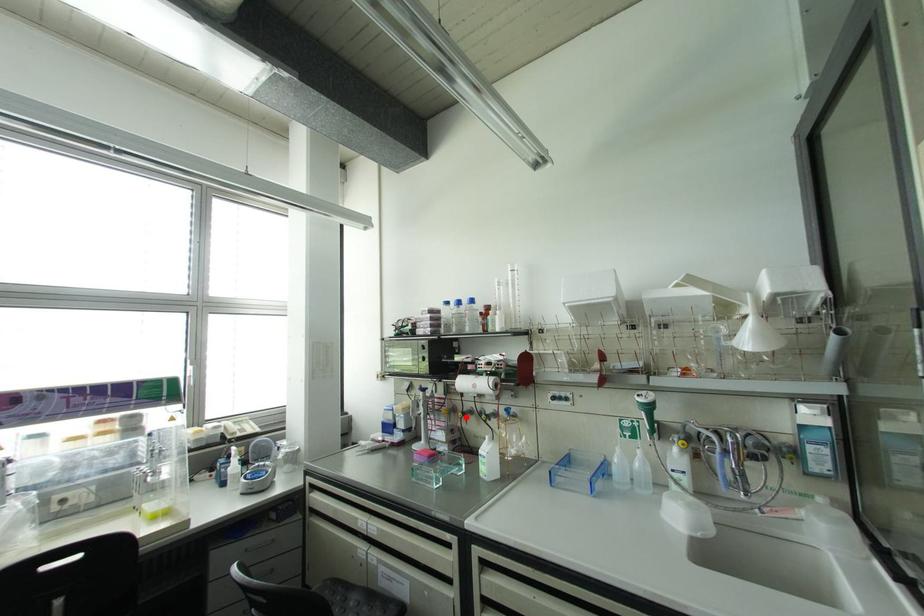
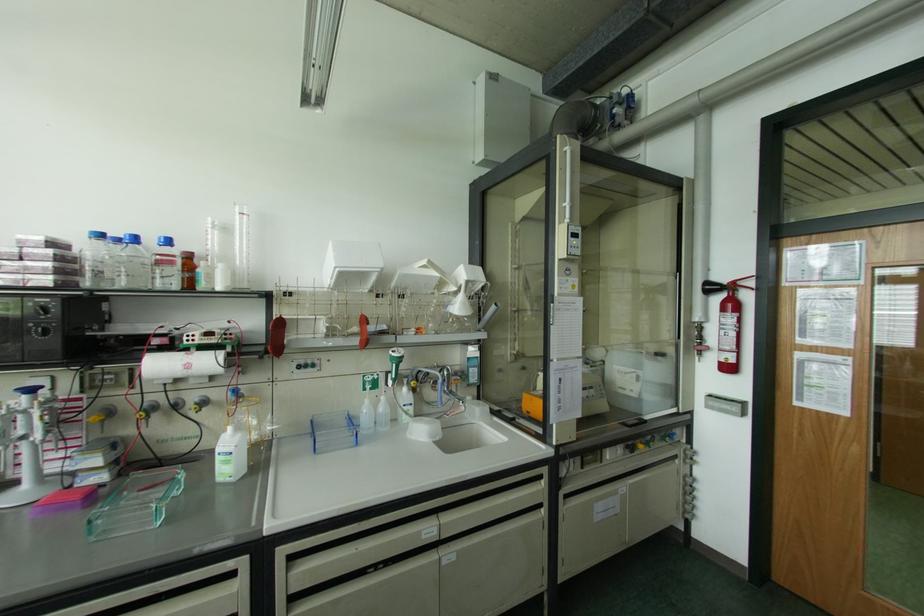
Where in the second image is the point corresponding to the highlighted location from the first image?

(148, 416)